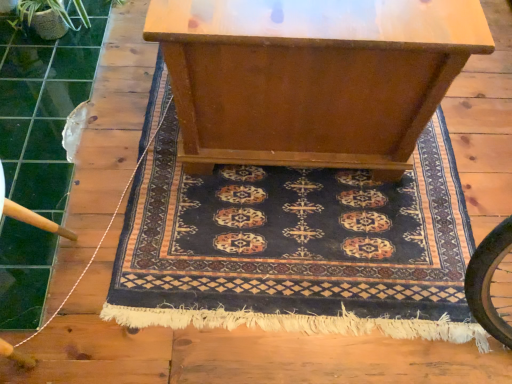
At what (x,y) coordinates should I click in order to perform the action: click on blank area beneath dark blue woven rug at center (from a real-world perspective). Please return your answer as a coordinate pair (x, y). This screenshot has width=512, height=384. Looking at the image, I should click on (298, 228).